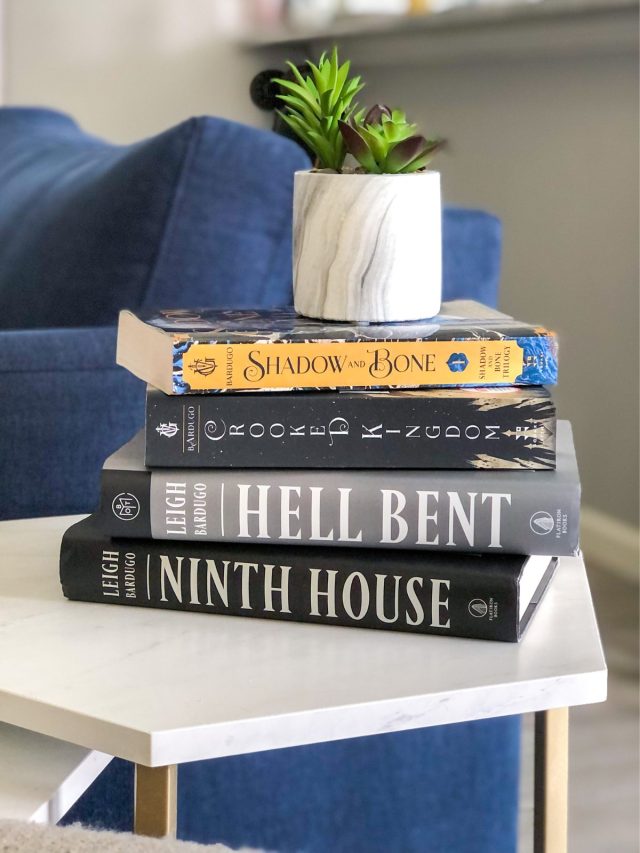
Image resolution: width=640 pixels, height=853 pixels. Identify the location of white table. pyautogui.click(x=224, y=710).